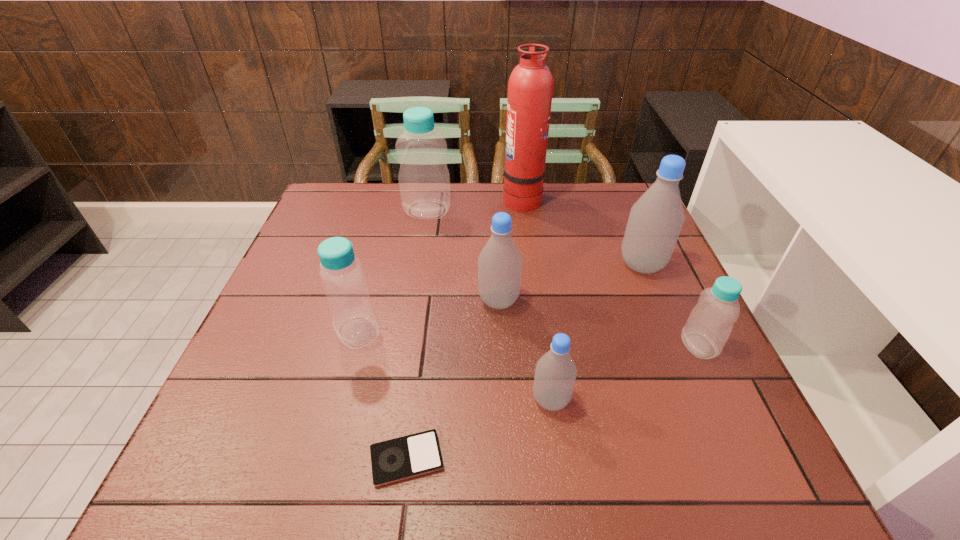
This screenshot has width=960, height=540. I want to click on vacant space that satisfies the following two spatial constraints: 1. on the back side of the rightmost gray bottle; 2. on the right side of the nearest bottle, so click(533, 265).